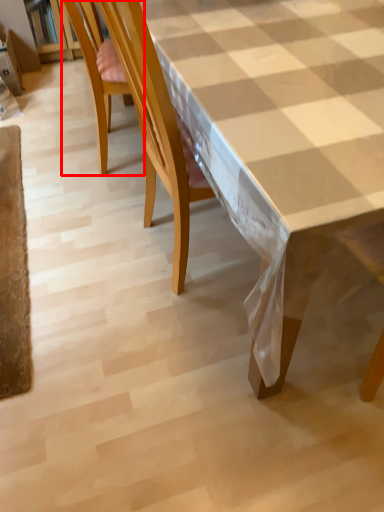
Question: From the image's perspective, considering the relative positions of chair (annotated by the red box) and table in the image provided, where is chair (annotated by the red box) located with respect to the staircase?

Choices:
 (A) below
 (B) above

Answer: (B)